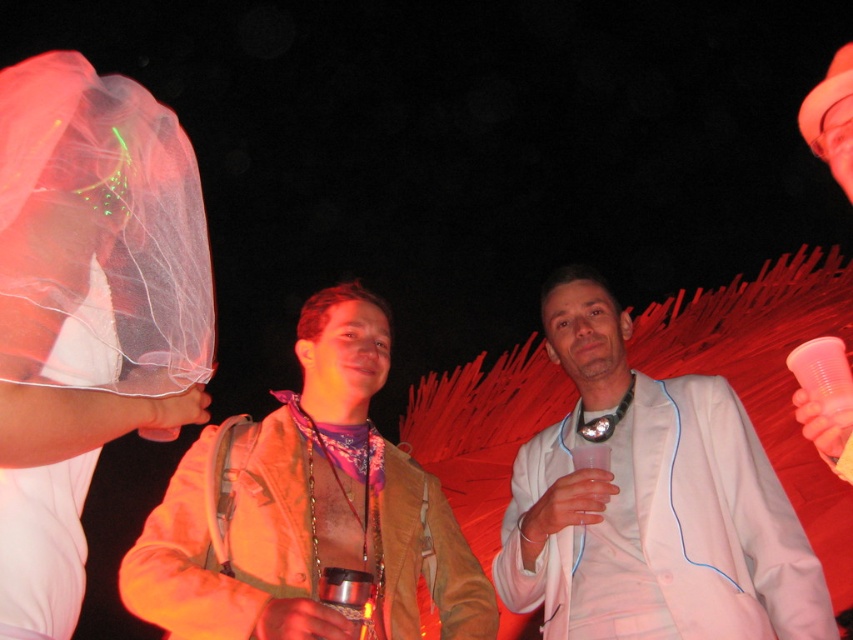
Does white matte suit at center have a lesser height compared to brown leather jacket at center?

A: No, white matte suit at center is not shorter than brown leather jacket at center.

Identify the location of white matte suit at center. tap(650, 502).

Image resolution: width=853 pixels, height=640 pixels. I want to click on white matte suit at center, so click(650, 502).